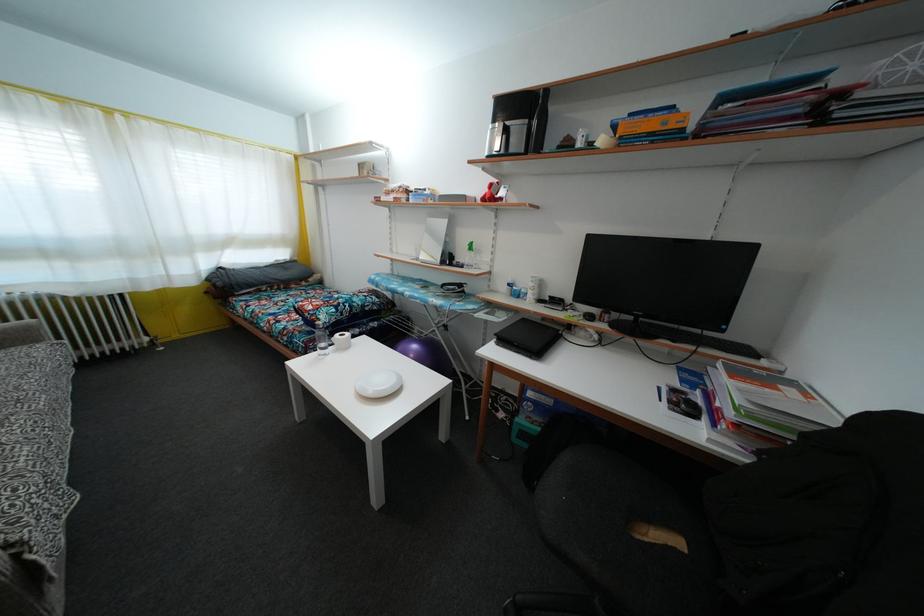
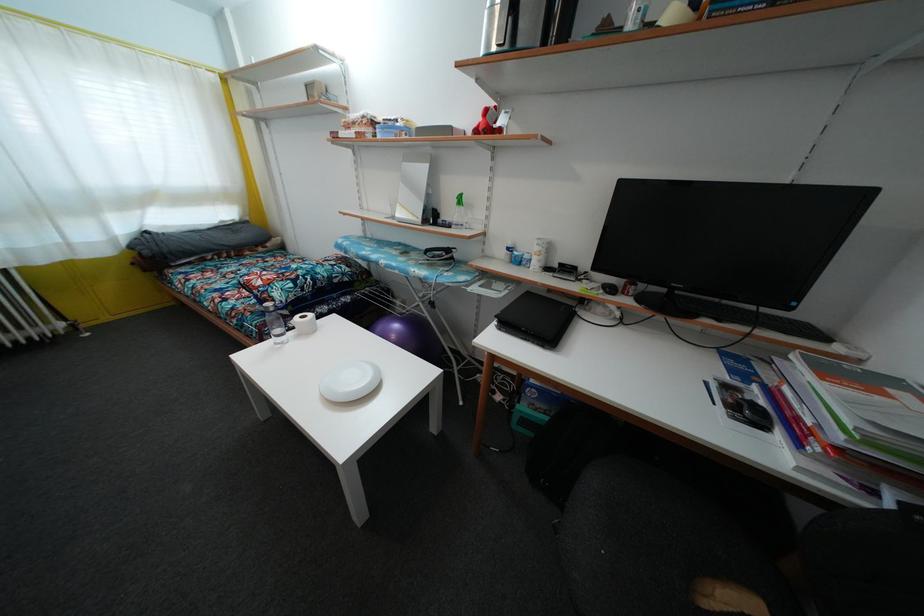
Find the pixel in the second image that matches pixel 429 341 in the first image.

(411, 315)